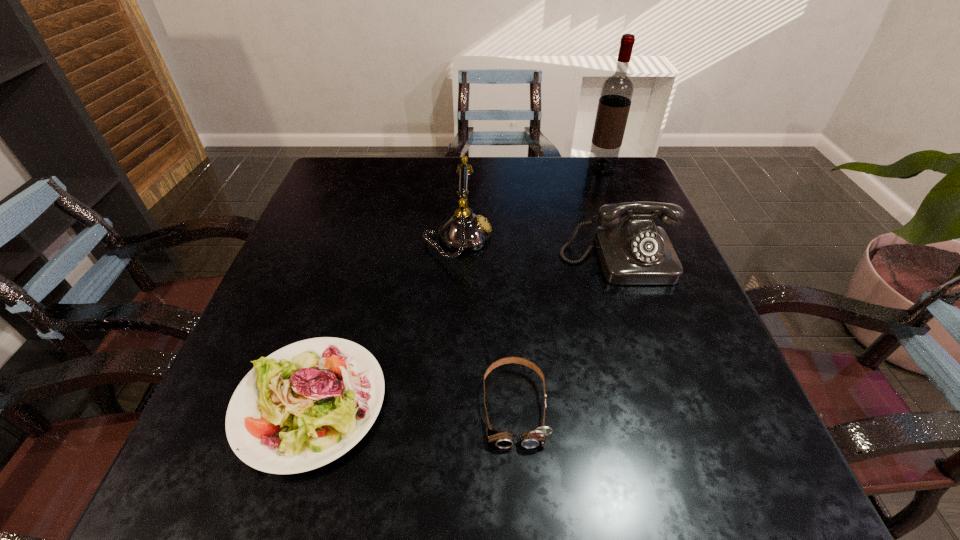
You are a GUI agent. You are given a task and a screenshot of the screen. Output one action in this format:
    pyautogui.click(x=<x>, y=<y>)
    Task: Click on the vacant region located 0.240m on the dial of the shorter telephone
    
    Given the screenshot: What is the action you would take?
    pyautogui.click(x=660, y=385)

Find the location of a particular element. This screenshot has width=960, height=540. vacant space situated on the right of the salad plate is located at coordinates (590, 402).

This screenshot has width=960, height=540. I want to click on vacant area situated on the front-facing side of the goggles, so click(x=520, y=497).

Find the location of a particular element. This screenshot has height=540, width=960. object that is at the far edge is located at coordinates (617, 90).

In order to click on salad plate at the near edge in this screenshot , I will do `click(305, 405)`.

Identify the location of goggles that is at the near edge. (502, 439).

You are a GUI agent. You are given a task and a screenshot of the screen. Output one action in this format:
    pyautogui.click(x=<x>, y=<y>)
    Task: Click on the object at the left edge
    This screenshot has height=540, width=960.
    Given the screenshot: What is the action you would take?
    pyautogui.click(x=305, y=405)

This screenshot has width=960, height=540. Identify the location of wine bottle present at the right edge. (617, 90).

I want to click on telephone that is at the right edge, so click(632, 250).

The width and height of the screenshot is (960, 540). What are the coordinates of `object at the near left corner` in the screenshot? It's located at (305, 405).